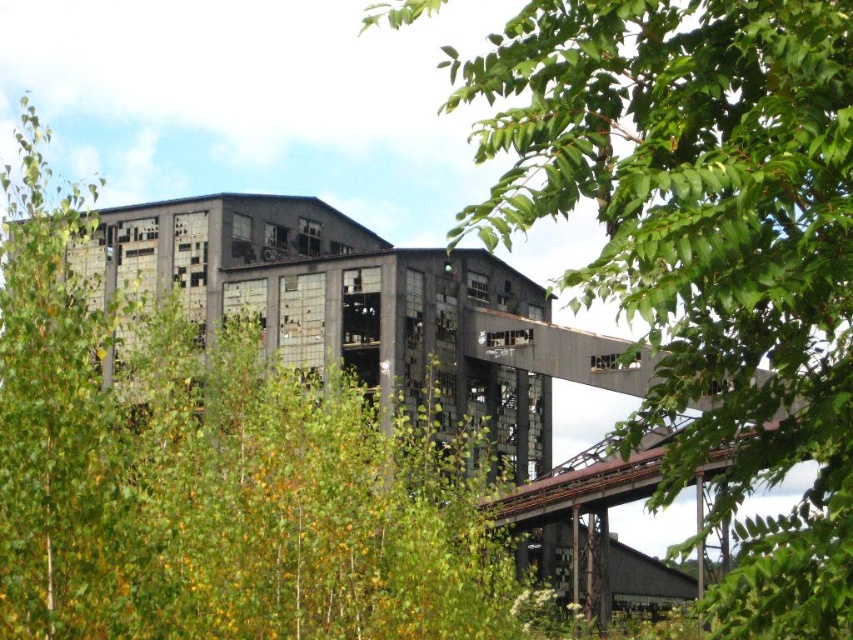
Question: Is the position of green leafy tree at upper right more distant than that of green leafy tree at center?

Choices:
 (A) yes
 (B) no

Answer: (B)

Question: Can you confirm if green leafy tree at upper right is wider than green leafy tree at center?

Choices:
 (A) no
 (B) yes

Answer: (A)

Question: Among these points, which one is nearest to the camera?

Choices:
 (A) (813, 19)
 (B) (300, 440)

Answer: (A)

Question: Does green leafy tree at upper right appear on the right side of green leafy tree at center?

Choices:
 (A) no
 (B) yes

Answer: (B)

Question: Which object is farther from the camera taking this photo?

Choices:
 (A) green leafy tree at center
 (B) green leafy tree at upper right

Answer: (A)